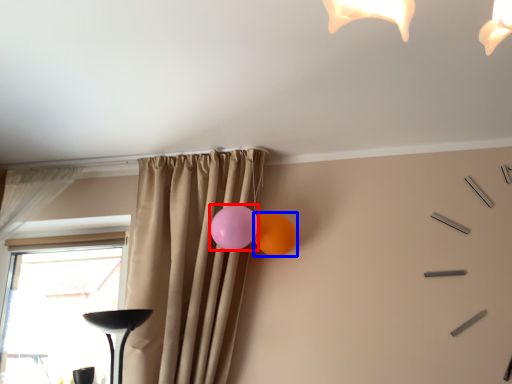
Question: Which object is further to the camera taking this photo, balloon (highlighted by a red box) or balloon (highlighted by a blue box)?

Choices:
 (A) balloon
 (B) balloon

Answer: (B)